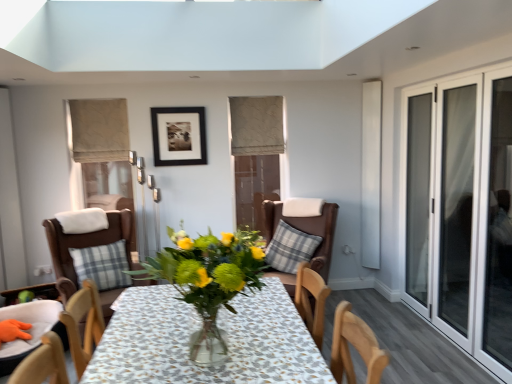
Question: Is black matte picture frame at upper center smaller than beige fabric curtain at upper center, which appears as the 2th curtain when viewed from the left?

Choices:
 (A) yes
 (B) no

Answer: (A)

Question: Does black matte picture frame at upper center have a greater width compared to beige fabric curtain at upper center, marked as the second curtain in a front-to-back arrangement?

Choices:
 (A) yes
 (B) no

Answer: (B)

Question: Is black matte picture frame at upper center not within beige fabric curtain at upper center, which is the first curtain from back to front?

Choices:
 (A) yes
 (B) no

Answer: (A)

Question: Is black matte picture frame at upper center facing towards beige fabric curtain at upper center, which appears as the 2th curtain when viewed from the left?

Choices:
 (A) no
 (B) yes

Answer: (A)

Question: Does black matte picture frame at upper center have a lesser height compared to beige fabric curtain at upper center, which is the first curtain from back to front?

Choices:
 (A) yes
 (B) no

Answer: (A)

Question: From the image's perspective, is beige fabric curtain at upper left, positioned as the 2th curtain in back-to-front order, positioned above or below brown leather chair at left, the second chair in the right-to-left sequence?

Choices:
 (A) below
 (B) above

Answer: (B)

Question: From their relative heights in the image, would you say beige fabric curtain at upper left, the 1th curtain when ordered from left to right, is taller or shorter than brown leather chair at left, which is counted as the second chair, starting from the left?

Choices:
 (A) short
 (B) tall

Answer: (A)

Question: From a real-world perspective, is beige fabric curtain at upper left, the 1th curtain when ordered from left to right, above or below brown leather chair at left, the second chair in the right-to-left sequence?

Choices:
 (A) below
 (B) above

Answer: (B)

Question: Is beige fabric curtain at upper left, the 1th curtain when ordered from left to right, in front of or behind brown leather chair at left, the second chair in the right-to-left sequence, in the image?

Choices:
 (A) behind
 (B) front

Answer: (A)

Question: Considering the positions of point (415, 215) and point (467, 210), is point (415, 215) closer or farther from the camera than point (467, 210)?

Choices:
 (A) closer
 (B) farther

Answer: (B)

Question: Would you say transparent glass door at right is inside or outside transparent glass sliding door at right?

Choices:
 (A) outside
 (B) inside

Answer: (B)

Question: From the image's perspective, is transparent glass door at right located above or below transparent glass sliding door at right?

Choices:
 (A) below
 (B) above

Answer: (B)

Question: From a real-world perspective, is transparent glass door at right above or below transparent glass sliding door at right?

Choices:
 (A) above
 (B) below

Answer: (B)

Question: Does point (53, 301) appear closer or farther from the camera than point (472, 244)?

Choices:
 (A) farther
 (B) closer

Answer: (A)

Question: Relative to transparent glass screen door at right, is wooden chair at lower left, the third chair when ordered from right to left, in front or behind?

Choices:
 (A) front
 (B) behind

Answer: (B)